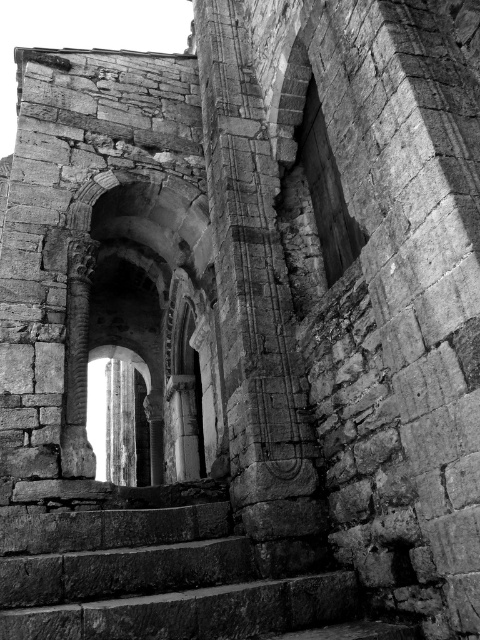
You are standing at the entrance of the ancient stone structure and want to locate the stone archway at center. According to the coordinates provided, where should you look to find it?

The stone archway at center is located at coordinates point 0.506 on the x axis and 0.300 on the y axis.

You are an architect examining the ancient stone structure. You need to determine which object, the stone archway at center or the rough stone stairs at center, is taller. Based on the scene, which one is taller?

The stone archway at center is taller than the rough stone stairs at center according to the description.

You are standing in this ancient stone structure and want to walk towards the stone archway at center and the rough stone stairs at center. Which one would you approach first?

You would approach the stone archway at center first because it is closer to you than the rough stone stairs at center, which are further away.